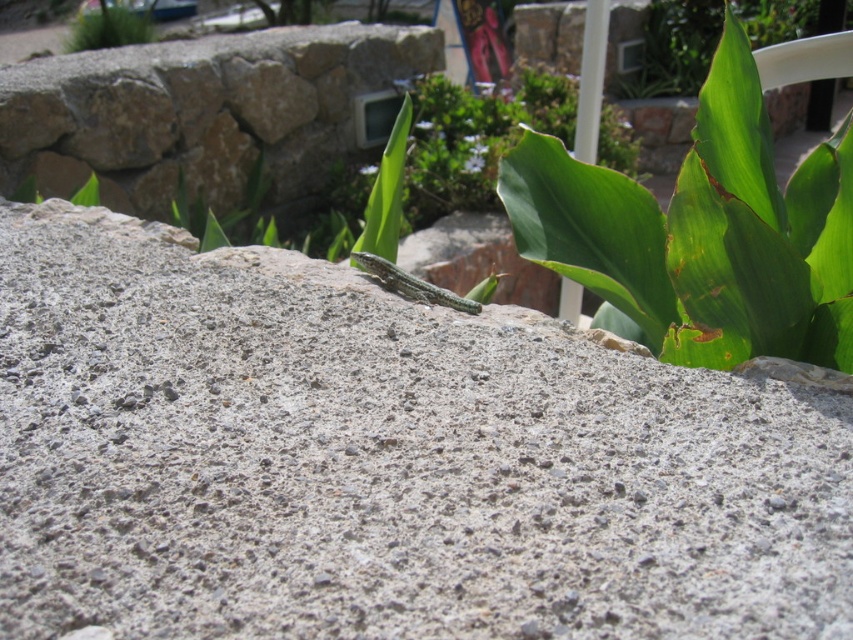
Question: Is gray rough concrete at center wider than green scaly lizard at center?

Choices:
 (A) yes
 (B) no

Answer: (A)

Question: Does gray rough concrete at center lie behind green scaly lizard at center?

Choices:
 (A) no
 (B) yes

Answer: (A)

Question: Estimate the real-world distances between objects in this image. Which object is closer to the gray rough concrete at center?

Choices:
 (A) green leafy plant at center right
 (B) green scaly lizard at center
 (C) green leafy plant at upper left

Answer: (B)

Question: Which point is closer to the camera?

Choices:
 (A) (73, 20)
 (B) (699, 240)
 (C) (173, 513)
 (D) (416, 285)

Answer: (C)

Question: Is gray rough concrete at center wider than green leafy plant at upper left?

Choices:
 (A) no
 (B) yes

Answer: (B)

Question: Which object appears farthest from the camera in this image?

Choices:
 (A) green scaly lizard at center
 (B) green leafy plant at center right
 (C) green leafy plant at upper left

Answer: (C)